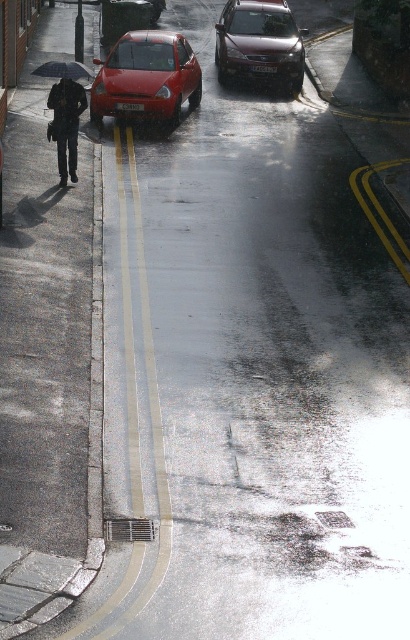
You are a delivery person trying to park your vehicle in a tight space between the two cars at the center of the street. The space between them is exactly 2 meters wide. Your delivery van is 1.8 meters wide. Can you safely park your van between the shiny red car at center and the shiny metallic car at center?

The space between the shiny red car at center and the shiny metallic car at center is 2 meters wide, and your delivery van is 1.8 meters wide. Since the space is wider than the van, you can safely park your van between them.

You are standing at the point with coordinates (145, 77) in the image. What object are you directly in front of?

The point (145, 77) corresponds to the shiny red car at center.

Looking at this image, you are standing at point [20,227] and want to cross the street to the other side. Is there enough space between the two parked cars to safely pass through?

The two parked cars are 14.87 meters apart, which provides ample space for a person to safely pass through while crossing the street.